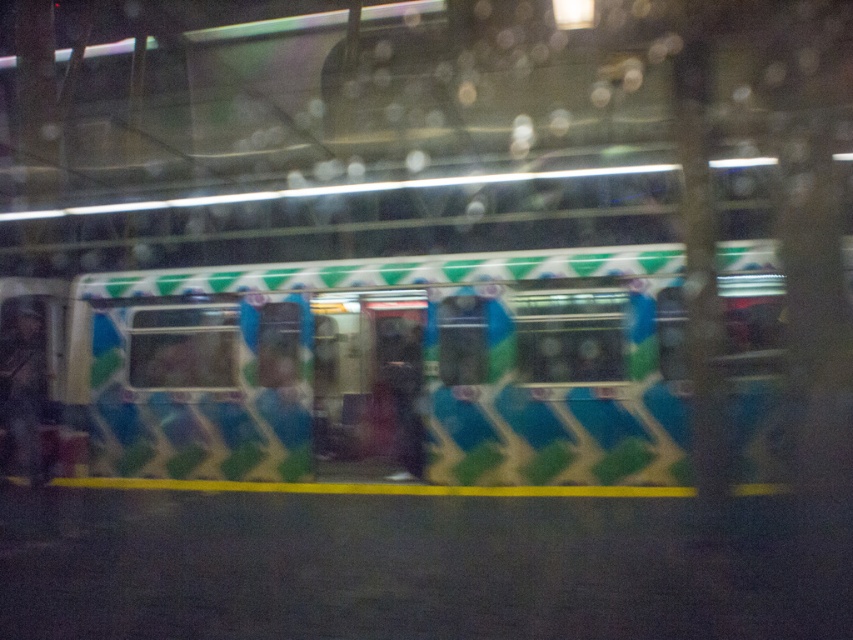
Who is more forward, [160,387] or [15,340]?

Point [160,387] is in front.

Find the location of a particular element. matte green and blue train at center is located at coordinates (381, 365).